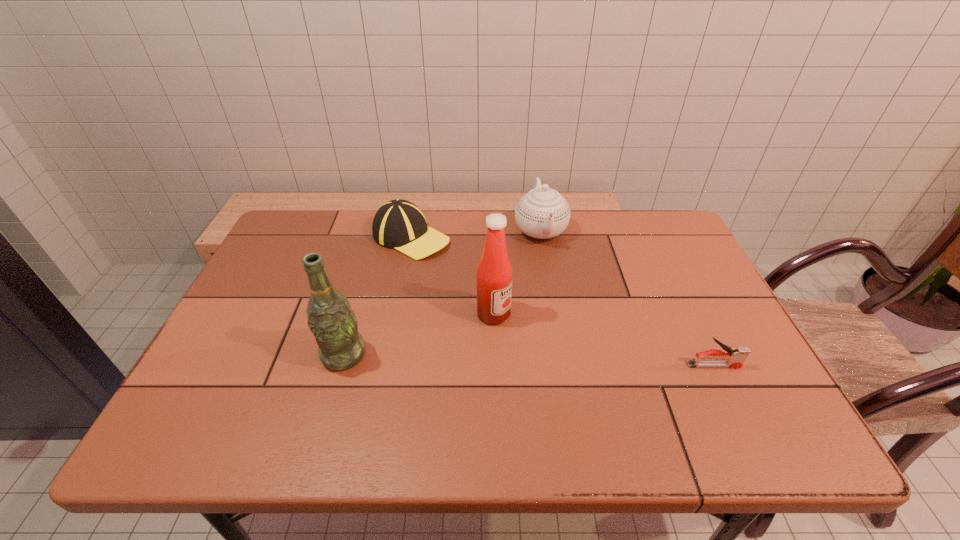
This screenshot has height=540, width=960. What are the coordinates of `beer bottle` in the screenshot? It's located at (331, 320).

Identify the location of the rightmost object. This screenshot has width=960, height=540. (735, 358).

At what (x,y) coordinates should I click in order to perform the action: click on the third nearest object. Please return your answer as a coordinate pair (x, y). The height and width of the screenshot is (540, 960). Looking at the image, I should click on (494, 274).

Identify the location of the third object from right to left. The width and height of the screenshot is (960, 540). (494, 274).

Where is `baseball cap`? This screenshot has width=960, height=540. baseball cap is located at coordinates (399, 224).

Find the location of a particular element. chinaware is located at coordinates (542, 213).

The image size is (960, 540). What are the coordinates of `the fourth object from left to right` in the screenshot? It's located at (542, 213).

Find the location of a particular element. Image resolution: width=960 pixels, height=540 pixels. vacant area situated on the surface of the beer bottle is located at coordinates (331, 400).

Identify the location of vacant space situated on the front-facing side of the condiment. (580, 372).

Find the location of a particular element. vacant region located on the front-facing side of the condiment is located at coordinates (548, 350).